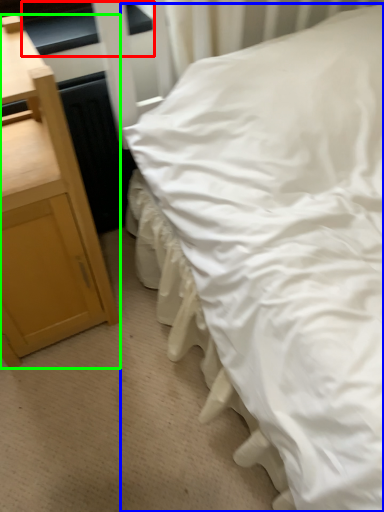
Question: Which object is positioned closest to window sill (highlighted by a red box)? Select from bed (highlighted by a blue box) and nightstand (highlighted by a green box).

Choices:
 (A) bed
 (B) nightstand

Answer: (B)